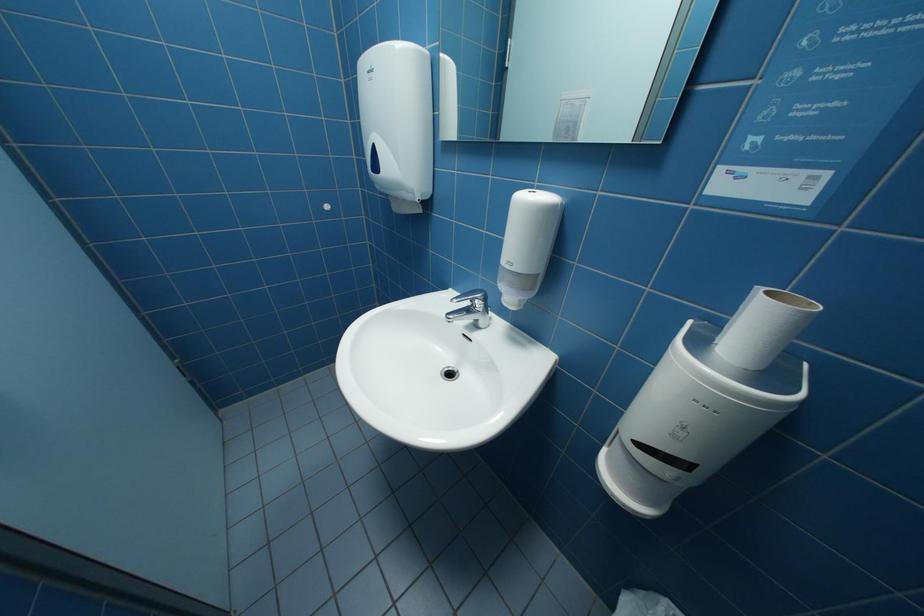
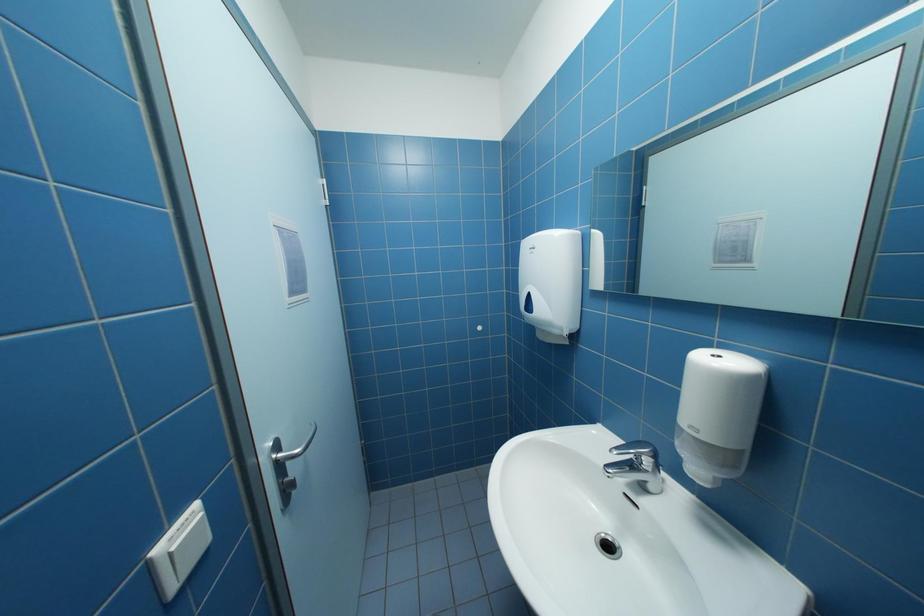
The first image is from the beginning of the video and the second image is from the end. How did the camera likely rotate when shooting the video?

The camera rotated toward left-up.